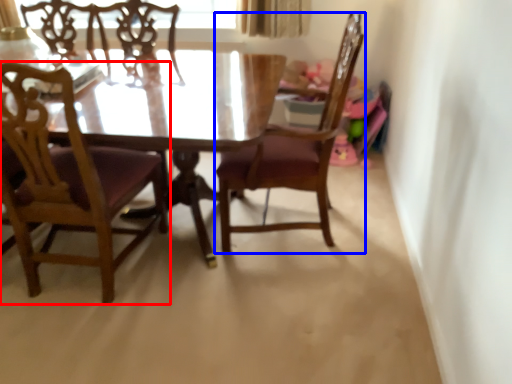
Question: Which point is further to the camera, chair (highlighted by a red box) or chair (highlighted by a blue box)?

Choices:
 (A) chair
 (B) chair

Answer: (B)